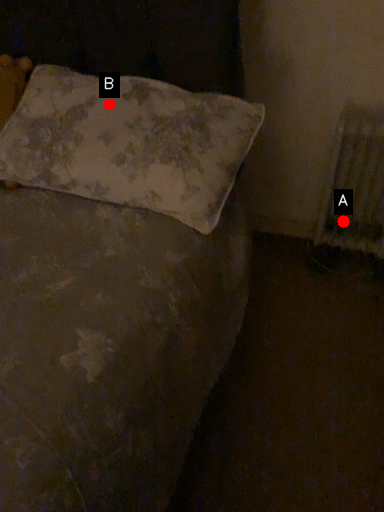
Question: Two points are circled on the image, labeled by A and B beside each circle. Among these points, which one is farthest from the camera?

Choices:
 (A) A is further
 (B) B is further

Answer: (A)